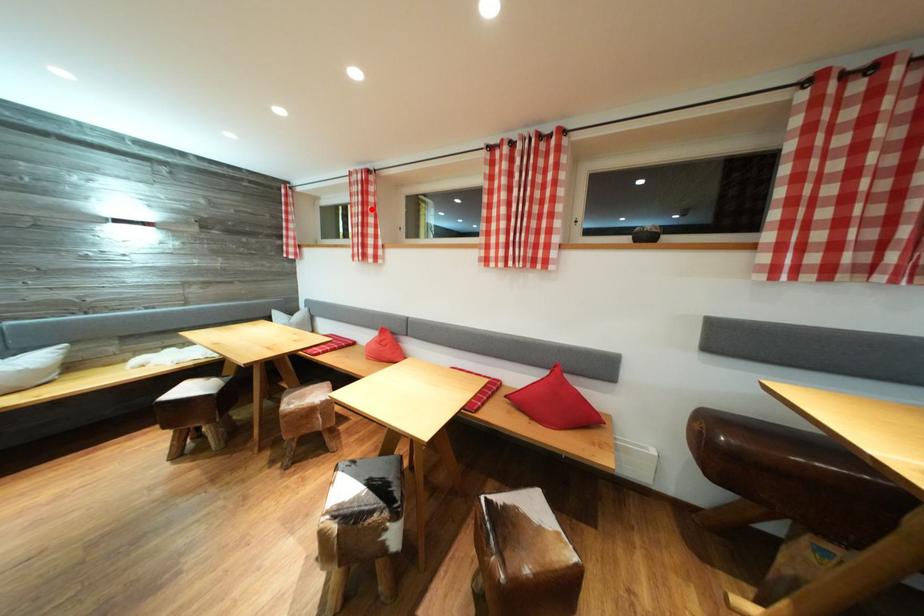
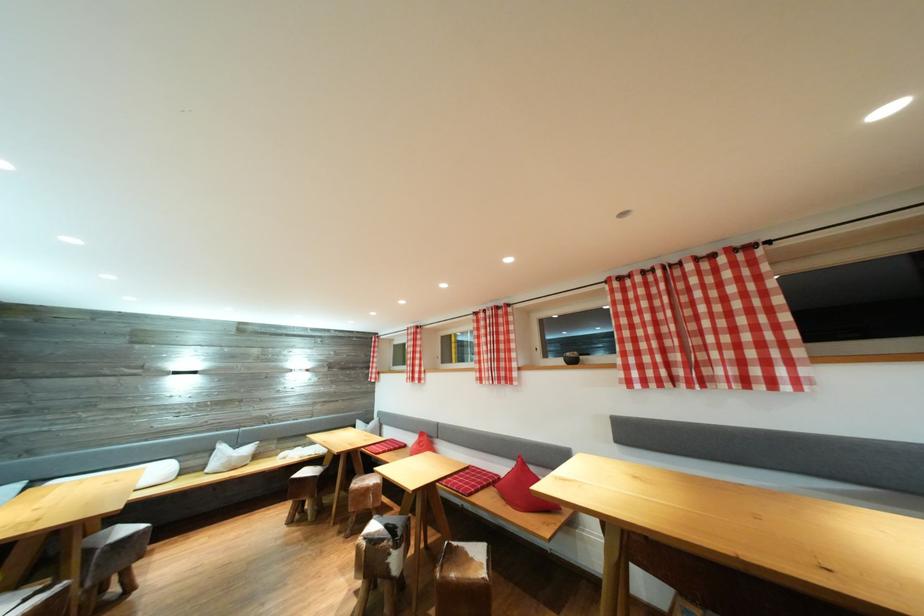
Question: I am providing you with two images of the same scene from different viewpoints. A red point is shown in image1. For the corresponding object point in image2, is it positioned nearer or farther from the camera?

Choices:
 (A) Nearer
 (B) Farther

Answer: (B)